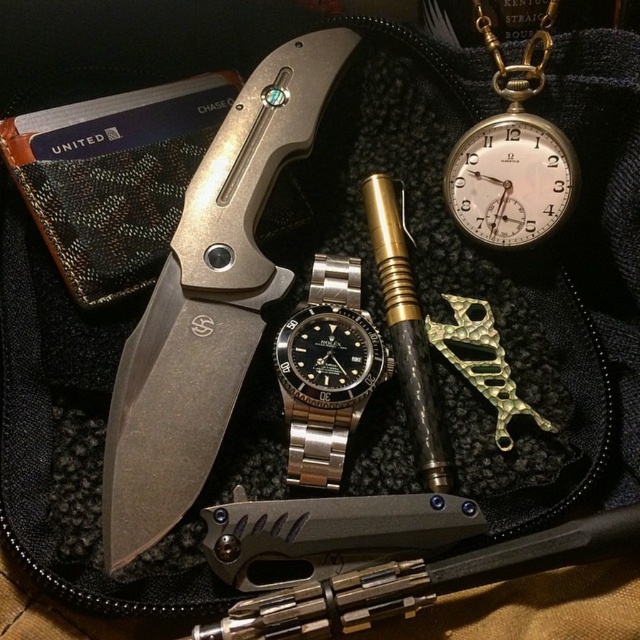
Could you measure the distance between gold/brass pocket watch at upper right and gold textured fish-shaped pendant at center-right?

9.34 inches

Locate an element on the screen. The image size is (640, 640). gold/brass pocket watch at upper right is located at coordinates click(512, 154).

At what (x,y) coordinates should I click in order to perform the action: click on gold/brass pocket watch at upper right. Please return your answer as a coordinate pair (x, y). The height and width of the screenshot is (640, 640). Looking at the image, I should click on (512, 154).

Which is below, matte silver knife at upper left or gold/brass pocket watch at upper right?

matte silver knife at upper left

Is matte silver knife at upper left positioned at the back of gold/brass pocket watch at upper right?

No, matte silver knife at upper left is closer to the viewer.

Is point (193, 326) positioned after point (563, 180)?

Yes, point (193, 326) is farther from viewer.

You are a GUI agent. You are given a task and a screenshot of the screen. Output one action in this format:
    pyautogui.click(x=<x>, y=<y>)
    Task: Click on the matte silver knife at upper left
    This screenshot has width=640, height=640.
    Given the screenshot: What is the action you would take?
    pyautogui.click(x=208, y=301)

Is matte silver knife at upper left thinner than gold textured fish-shaped pendant at center-right?

In fact, matte silver knife at upper left might be wider than gold textured fish-shaped pendant at center-right.

Does matte silver knife at upper left have a lesser height compared to gold textured fish-shaped pendant at center-right?

No, matte silver knife at upper left is not shorter than gold textured fish-shaped pendant at center-right.

Who is more distant from viewer, [272,77] or [499,403]?

Positioned behind is point [272,77].

Identify the location of matte silver knife at upper left. The image size is (640, 640). (208, 301).